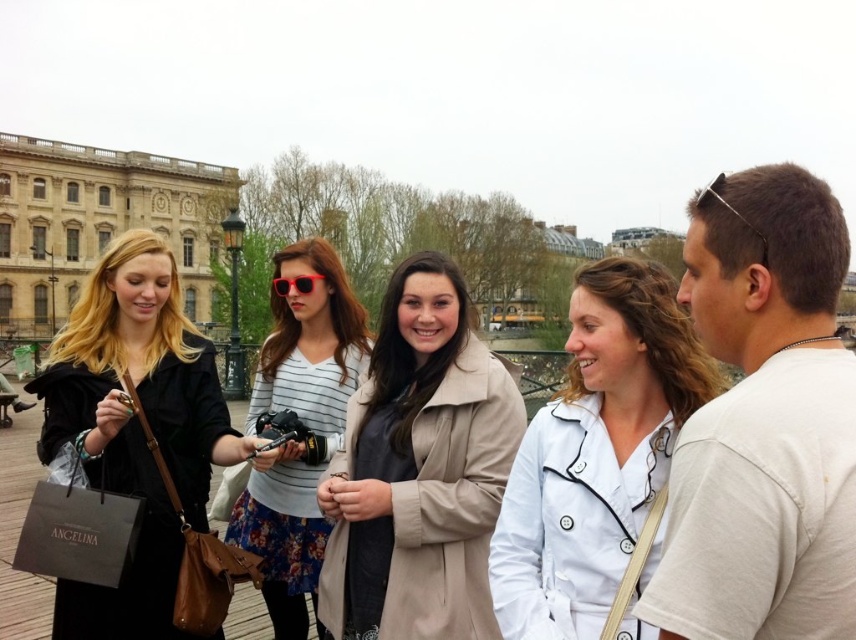
Who is more distant from viewer, (798, 362) or (528, 470)?

Point (528, 470)

Between light beige t-shirt at right and white matte coat at center, which one has more height?

With more height is light beige t-shirt at right.

Is point (712, 257) more distant than point (599, 492)?

That is False.

The width and height of the screenshot is (856, 640). Find the location of `light beige t-shirt at right`. light beige t-shirt at right is located at coordinates (764, 422).

Between white matte coat at center and brown stone building at upper left, which one appears on the left side from the viewer's perspective?

Positioned to the left is brown stone building at upper left.

Does white matte coat at center have a lesser width compared to brown stone building at upper left?

Incorrect, white matte coat at center's width is not less than brown stone building at upper left's.

Locate an element on the screen. This screenshot has height=640, width=856. white matte coat at center is located at coordinates (599, 461).

Is beige leather coat at center wider than red plastic sunglasses at center?

Correct, the width of beige leather coat at center exceeds that of red plastic sunglasses at center.

Between beige leather coat at center and red plastic sunglasses at center, which one is positioned higher?

red plastic sunglasses at center is above.

Locate an element on the screen. beige leather coat at center is located at coordinates (419, 470).